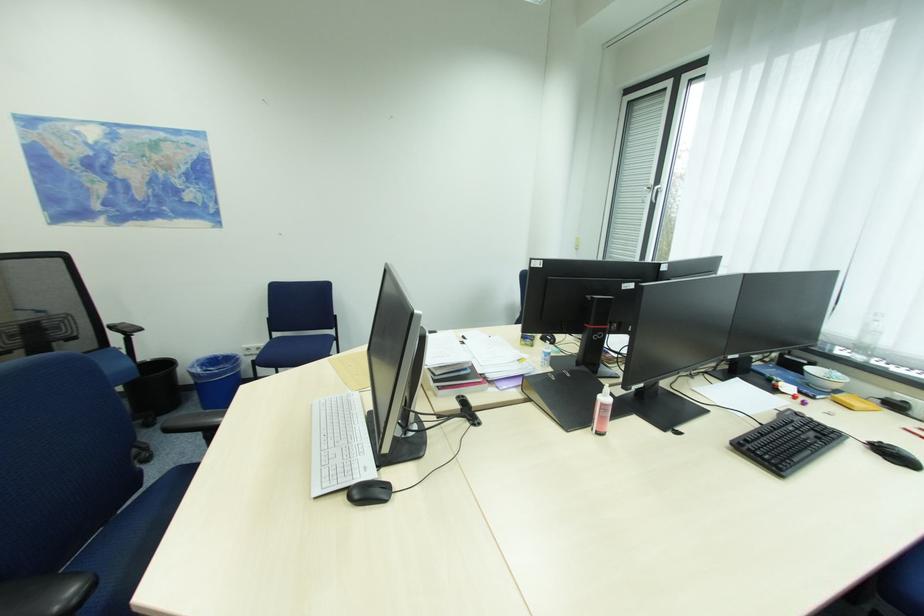
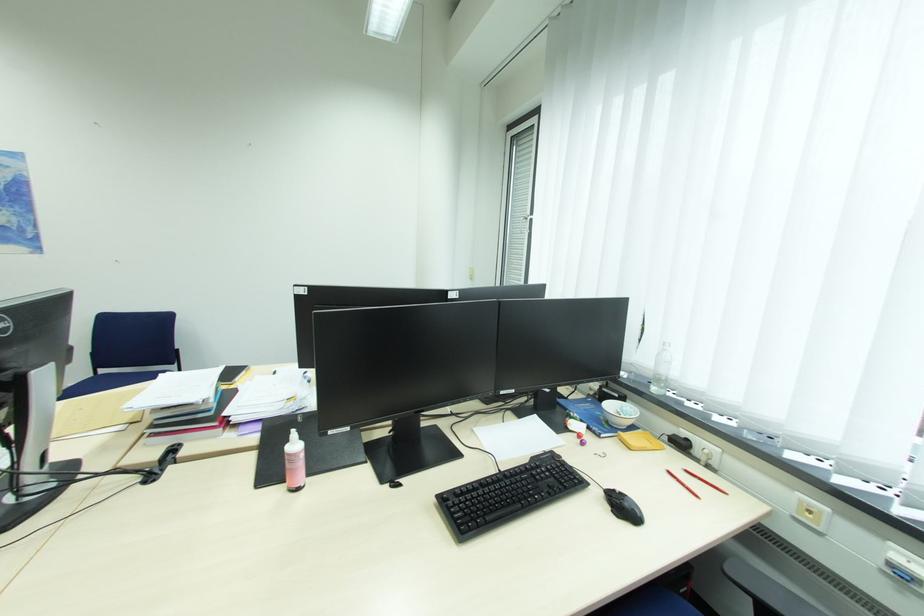
Question: Which direction would the cameraman need to move to produce the second image? Reply with the corresponding letter.

Choices:
 (A) Left
 (B) Right
 (C) Forward
 (D) Backward

Answer: (B)